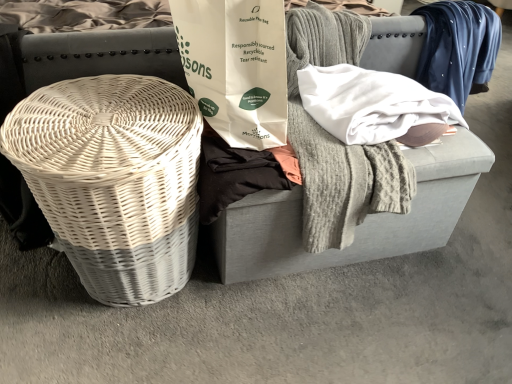
Question: From a real-world perspective, is gray fabric footrest at center positioned above or below black cotton shirt at center?

Choices:
 (A) above
 (B) below

Answer: (B)

Question: Is gray fabric footrest at center wider or thinner than black cotton shirt at center?

Choices:
 (A) wide
 (B) thin

Answer: (A)

Question: Considering the real-world distances, which object is farthest from the white wicker basket at left?

Choices:
 (A) gray fabric footrest at center
 (B) black cotton shirt at center
 (C) white paper bag at center
 (D) white wicker basket at left

Answer: (A)

Question: Which object is the farthest from the black cotton shirt at center?

Choices:
 (A) white paper bag at center
 (B) white wicker basket at left
 (C) gray fabric footrest at center
 (D) white wicker basket at left

Answer: (C)